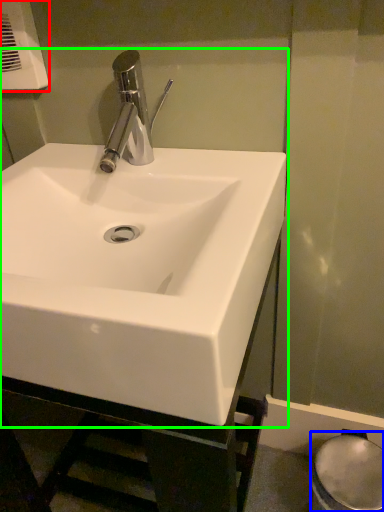
Question: Which object is positioned closest to hand dryer (highlighted by a red box)? Select from bidet (highlighted by a blue box) and sink (highlighted by a green box).

Choices:
 (A) bidet
 (B) sink

Answer: (B)